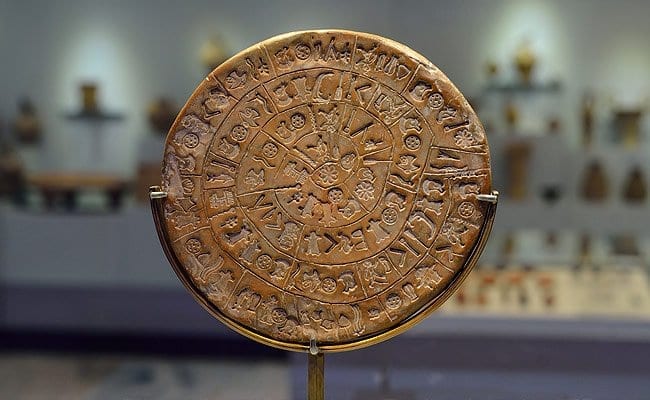
Locate an element on the screen. This screenshot has width=650, height=400. wall is located at coordinates (459, 36), (151, 21).